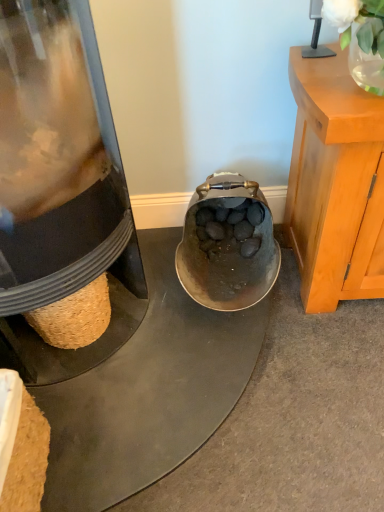
This screenshot has width=384, height=512. In order to click on free space in front of matte black kettle at lower left in this screenshot , I will do `click(147, 437)`.